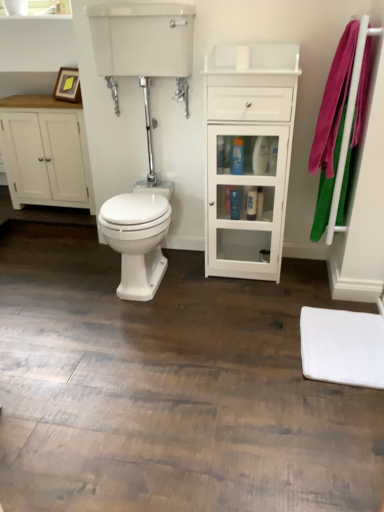
Question: From a real-world perspective, relative to white matte mat at lower right, is white glossy bidet at center vertically above or below?

Choices:
 (A) above
 (B) below

Answer: (A)

Question: From the image's perspective, is white glossy bidet at center located above or below white matte mat at lower right?

Choices:
 (A) below
 (B) above

Answer: (B)

Question: Estimate the real-world distances between objects in this image. Which object is farther from the wooden picture frame at upper left?

Choices:
 (A) white glossy cabinet at center
 (B) white glossy tank at upper center
 (C) pink fabric bath towel at right
 (D) white glossy bidet at center
 (E) blue glossy bottle at center, the second toiletry in the bottom-to-top sequence

Answer: (C)

Question: Which of these objects is positioned closest to the wooden picture frame at upper left?

Choices:
 (A) white matte mat at lower right
 (B) white glossy cabinet at center
 (C) translucent plastic bottle at center, which appears as the second toiletry when viewed from the top
 (D) white glossy tank at upper center
 (E) white matte cabinet at left

Answer: (E)